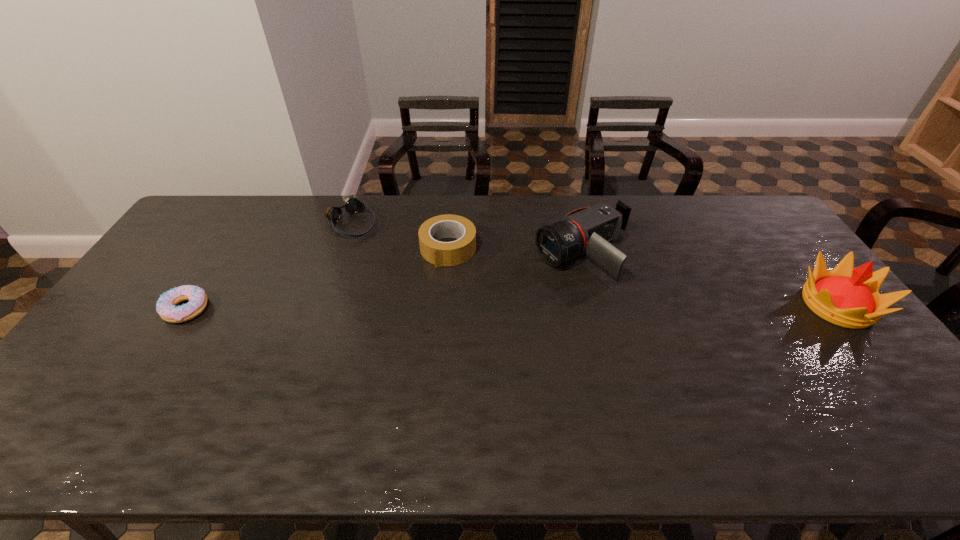
This screenshot has height=540, width=960. I want to click on duct tape that is at the far edge, so click(439, 253).

I want to click on goggles positioned at the far edge, so click(x=353, y=206).

Locate an element on the screen. object that is at the left edge is located at coordinates (166, 307).

What are the coordinates of `object that is positioned at the right edge` in the screenshot? It's located at (849, 297).

The width and height of the screenshot is (960, 540). In order to click on vacant area at the far edge in this screenshot , I will do `click(260, 223)`.

I want to click on vacant point at the near edge, so click(x=294, y=397).

I want to click on vacant space at the left edge, so click(134, 366).

Where is `vacant space at the far right corner`? This screenshot has height=540, width=960. vacant space at the far right corner is located at coordinates (747, 212).

At what (x,y) coordinates should I click in order to perform the action: click on vacant area between the third object from left to right and the camcorder. Please return your answer as a coordinate pair (x, y). Looking at the image, I should click on (516, 251).

I want to click on vacant space in between the crown and the fourth object from right to left, so click(x=595, y=264).